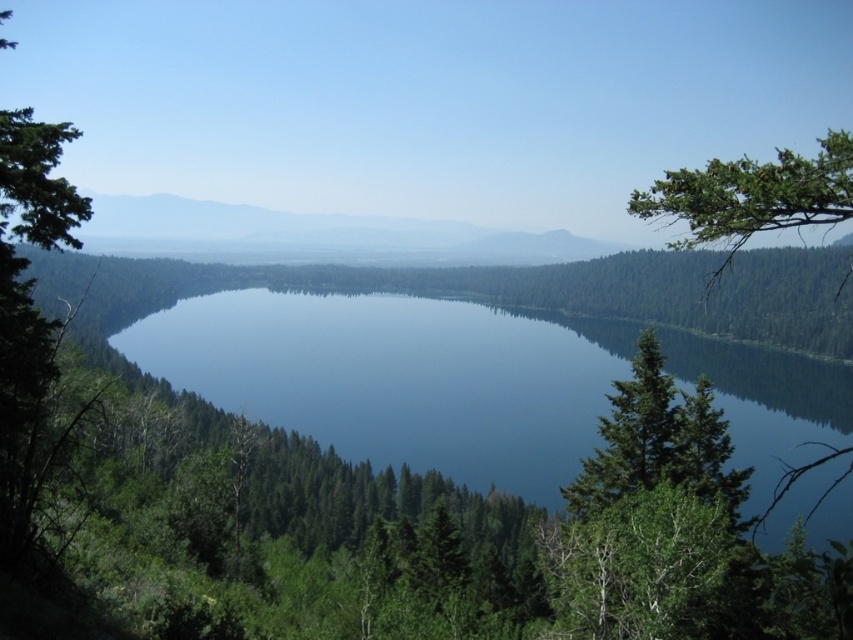
Does point (345, 394) come farther from viewer compared to point (722, 451)?

Yes, point (345, 394) is farther from viewer.

Which of these two, blue reflective water at center or green matte tree at right, stands shorter?

Standing shorter between the two is green matte tree at right.

Is point (579, 328) positioned in front of point (647, 451)?

No, it is not.

Locate an element on the screen. blue reflective water at center is located at coordinates (399, 378).

Between blue reflective water at center and smooth gray mountain at center, which one has less height?

blue reflective water at center

Who is lower down, blue reflective water at center or smooth gray mountain at center?

blue reflective water at center is below.

What are the coordinates of `blue reflective water at center` in the screenshot? It's located at coord(399,378).

At what (x,y) coordinates should I click in order to perform the action: click on blue reflective water at center. Please return your answer as a coordinate pair (x, y). The width and height of the screenshot is (853, 640). Looking at the image, I should click on (399, 378).

Measure the distance between smooth gray mountain at center and green matte tree at right.

smooth gray mountain at center is 1261.21 feet away from green matte tree at right.

Can you confirm if smooth gray mountain at center is thinner than green matte tree at right?

No.

The width and height of the screenshot is (853, 640). What do you see at coordinates (311, 236) in the screenshot?
I see `smooth gray mountain at center` at bounding box center [311, 236].

Where is `smooth gray mountain at center`? The height and width of the screenshot is (640, 853). smooth gray mountain at center is located at coordinates (311, 236).